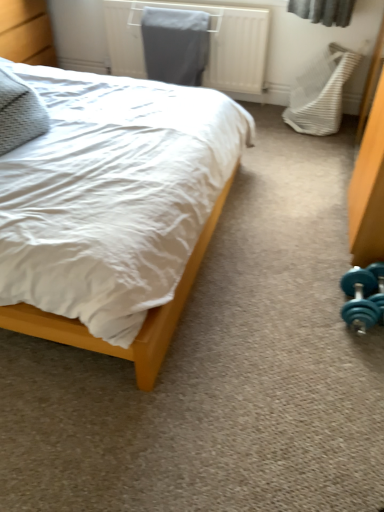
Identify the location of metallic gray radiator at upper center. (210, 44).

Which of these two, teal rubber dumbbell at lower right or metallic gray radiator at upper center, is wider?

With larger width is metallic gray radiator at upper center.

Looking at this image, is teal rubber dumbbell at lower right not within metallic gray radiator at upper center?

Yes, teal rubber dumbbell at lower right is not within metallic gray radiator at upper center.

Looking at this image, is teal rubber dumbbell at lower right positioned with its back to metallic gray radiator at upper center?

No.

Does point (353, 281) come farther from viewer compared to point (18, 88)?

Yes, point (353, 281) is farther from viewer.

In the scene shown: Measure the distance from teal rubber dumbbell at lower right to textured gray pillow at left.

teal rubber dumbbell at lower right is 4.89 feet from textured gray pillow at left.

Would you consider teal rubber dumbbell at lower right to be distant from textured gray pillow at left?

Yes, teal rubber dumbbell at lower right and textured gray pillow at left are located far from each other.

From the image's perspective, is teal rubber dumbbell at lower right over textured gray pillow at left?

Actually, teal rubber dumbbell at lower right appears below textured gray pillow at left in the image.

From a real-world perspective, is metallic gray radiator at upper center above or below teal rubber dumbbell at lower right?

From a real-world perspective, metallic gray radiator at upper center is physically above teal rubber dumbbell at lower right.

Where is `dumbbell on the right of metallic gray radiator at upper center`? This screenshot has width=384, height=512. dumbbell on the right of metallic gray radiator at upper center is located at coordinates (363, 297).

In terms of size, does metallic gray radiator at upper center appear bigger or smaller than teal rubber dumbbell at lower right?

Considering their sizes, metallic gray radiator at upper center takes up more space than teal rubber dumbbell at lower right.

From the picture: Is textured gray pillow at left facing away from white textured swivel chair at right?

No, textured gray pillow at left is not facing the opposite direction of white textured swivel chair at right.

Where is `pillow that is below the white textured swivel chair at right (from the image's perspective)`? pillow that is below the white textured swivel chair at right (from the image's perspective) is located at coordinates (19, 113).

From the picture: Which of these two, textured gray pillow at left or white textured swivel chair at right, is wider?

textured gray pillow at left.

Consider the image. From the image's perspective, is textured gray pillow at left under white textured swivel chair at right?

Correct, textured gray pillow at left appears lower than white textured swivel chair at right in the image.

Which of these two, teal rubber dumbbell at lower right or white textured swivel chair at right, is wider?

With larger width is white textured swivel chair at right.

Is white textured swivel chair at right inside teal rubber dumbbell at lower right?

No, white textured swivel chair at right is located outside of teal rubber dumbbell at lower right.

Can you confirm if teal rubber dumbbell at lower right is positioned to the right of white textured swivel chair at right?

No.

What's the angular difference between teal rubber dumbbell at lower right and white textured swivel chair at right's facing directions?

The angle between the facing direction of teal rubber dumbbell at lower right and the facing direction of white textured swivel chair at right is 89.2 degrees.

Is textured gray pillow at left further to camera compared to metallic gray radiator at upper center?

No, textured gray pillow at left is closer to the camera.

From their relative heights in the image, would you say textured gray pillow at left is taller or shorter than metallic gray radiator at upper center?

Considering their sizes, textured gray pillow at left has less height than metallic gray radiator at upper center.

From a real-world perspective, is textured gray pillow at left on metallic gray radiator at upper center?

Indeed, from a real-world perspective, textured gray pillow at left stands above metallic gray radiator at upper center.

Looking at this image, do you think textured gray pillow at left is within metallic gray radiator at upper center, or outside of it?

textured gray pillow at left is not inside metallic gray radiator at upper center, it's outside.

Could wooden bed at left be considered to be inside white textured swivel chair at right?

Definitely not — wooden bed at left is not inside white textured swivel chair at right.

Who is smaller, white textured swivel chair at right or wooden bed at left?

white textured swivel chair at right.

How far apart are white textured swivel chair at right and wooden bed at left?

white textured swivel chair at right is 1.04 meters from wooden bed at left.

What's the angular difference between white textured swivel chair at right and wooden bed at left's facing directions?

The angle between the facing direction of white textured swivel chair at right and the facing direction of wooden bed at left is 86.5 degrees.

Locate an element on the screen. This screenshot has width=384, height=512. dumbbell that is in front of the metallic gray radiator at upper center is located at coordinates pos(363,297).

The image size is (384, 512). I want to click on dumbbell behind the textured gray pillow at left, so click(x=363, y=297).

Considering their positions, is white textured swivel chair at right positioned further to wooden bed at left than metallic gray radiator at upper center?

metallic gray radiator at upper center lies further to wooden bed at left than the other object.

In the scene shown: Looking at the image, which one is located further to textured gray pillow at left, teal rubber dumbbell at lower right or white textured swivel chair at right?

Based on the image, white textured swivel chair at right appears to be further to textured gray pillow at left.

Which object lies further to the anchor point white textured swivel chair at right, teal rubber dumbbell at lower right or metallic gray radiator at upper center?

teal rubber dumbbell at lower right lies further to white textured swivel chair at right than the other object.

Considering their positions, is teal rubber dumbbell at lower right positioned closer to textured gray pillow at left than wooden bed at left?

wooden bed at left is positioned closer to the anchor textured gray pillow at left.

Considering their positions, is textured gray pillow at left positioned closer to white textured swivel chair at right than teal rubber dumbbell at lower right?

Based on the image, teal rubber dumbbell at lower right appears to be nearer to white textured swivel chair at right.

Looking at the image, which one is located closer to wooden bed at left, textured gray pillow at left or metallic gray radiator at upper center?

Among the two, textured gray pillow at left is located nearer to wooden bed at left.

From the image, which object appears to be farther from white textured swivel chair at right, metallic gray radiator at upper center or textured gray pillow at left?

Among the two, textured gray pillow at left is located further to white textured swivel chair at right.

Considering their positions, is white textured swivel chair at right positioned further to metallic gray radiator at upper center than textured gray pillow at left?

textured gray pillow at left is positioned further to the anchor metallic gray radiator at upper center.

You are a GUI agent. You are given a task and a screenshot of the screen. Output one action in this format:
    pyautogui.click(x=<x>, y=<y>)
    Task: Click on the swivel chair positioned between wooden bed at left and metallic gray radiator at upper center from near to far
    
    Given the screenshot: What is the action you would take?
    pyautogui.click(x=321, y=92)

Where is `pillow between metallic gray radiator at upper center and teal rubber dumbbell at lower right vertically`? pillow between metallic gray radiator at upper center and teal rubber dumbbell at lower right vertically is located at coordinates (19, 113).

What are the coordinates of `bed between textured gray pillow at left and teal rubber dumbbell at lower right in the horizontal direction` in the screenshot? It's located at (185, 265).

At what (x,y) coordinates should I click in order to perform the action: click on swivel chair between metallic gray radiator at upper center and teal rubber dumbbell at lower right from top to bottom. Please return your answer as a coordinate pair (x, y). The width and height of the screenshot is (384, 512). Looking at the image, I should click on (321, 92).